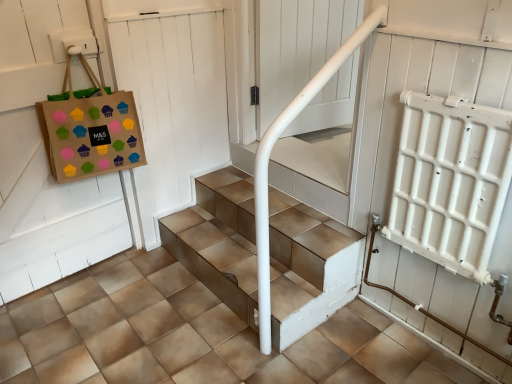
You are a GUI agent. You are given a task and a screenshot of the screen. Output one action in this format:
    pyautogui.click(x=<x>, y=<y>)
    Task: Click on the brown tile concrete at center
    
    Given the screenshot: What is the action you would take?
    pyautogui.click(x=193, y=336)

What do you see at coordinates (308, 268) in the screenshot? Image resolution: width=512 pixels, height=384 pixels. I see `metallic tile stairs at center` at bounding box center [308, 268].

What do you see at coordinates (174, 98) in the screenshot? I see `white wooden door at upper left` at bounding box center [174, 98].

The width and height of the screenshot is (512, 384). Find the location of `brown tile concrete at center`. brown tile concrete at center is located at coordinates (193, 336).

Do you think brown tile concrete at center is within white wooden door at upper left, or outside of it?

brown tile concrete at center is located beyond the bounds of white wooden door at upper left.

In terms of size, does brown tile concrete at center appear bigger or smaller than white wooden door at upper left?

Considering their sizes, brown tile concrete at center takes up more space than white wooden door at upper left.

Where is `concrete below the white wooden door at upper left (from the image's perspective)`? concrete below the white wooden door at upper left (from the image's perspective) is located at coordinates (193, 336).

Between metallic tile stairs at center and white wooden door at upper left, which one appears on the left side from the viewer's perspective?

Positioned to the left is white wooden door at upper left.

From a real-world perspective, which is physically above, metallic tile stairs at center or white wooden door at upper left?

white wooden door at upper left.

Considering their positions, is metallic tile stairs at center located in front of or behind white wooden door at upper left?

metallic tile stairs at center is in front of white wooden door at upper left.

Considering the relative sizes of metallic tile stairs at center and white wooden door at upper left in the image provided, is metallic tile stairs at center bigger than white wooden door at upper left?

Yes, metallic tile stairs at center is bigger than white wooden door at upper left.

Which point is more forward, (x=166, y=185) or (x=194, y=357)?

The point (x=194, y=357) is more forward.

How different are the orientations of white wooden door at upper left and brown tile concrete at center in degrees?

89.3 degrees.

Is white wooden door at upper left far away from brown tile concrete at center?

They are positioned close to each other.

Is there a large distance between white glossy handrail at upper center and brown tile concrete at center?

That's right, there is a large distance between white glossy handrail at upper center and brown tile concrete at center.

From the image's perspective, which one is positioned lower, white glossy handrail at upper center or brown tile concrete at center?

brown tile concrete at center is shown below in the image.

In terms of height, does white glossy handrail at upper center look taller or shorter compared to brown tile concrete at center?

white glossy handrail at upper center is taller than brown tile concrete at center.

How different are the orientations of white wooden door at upper left and metallic tile stairs at center in degrees?

white wooden door at upper left and metallic tile stairs at center are facing 91.1 degrees away from each other.

Is white wooden door at upper left positioned with its back to metallic tile stairs at center?

That's not correct — white wooden door at upper left is not looking away from metallic tile stairs at center.

Which of these two, white wooden door at upper left or metallic tile stairs at center, stands shorter?

metallic tile stairs at center.

Looking at this image, does white wooden door at upper left come in front of metallic tile stairs at center?

No, the depth of white wooden door at upper left is greater than that of metallic tile stairs at center.

Can you confirm if brown paper bag with colorful cupcake stickers at upper left is shorter than metallic tile stairs at center?

No.

From the image's perspective, would you say brown paper bag with colorful cupcake stickers at upper left is shown under metallic tile stairs at center?

Actually, brown paper bag with colorful cupcake stickers at upper left appears above metallic tile stairs at center in the image.

Is point (109, 102) positioned before point (236, 216)?

Yes, it is in front of point (236, 216).

From a real-world perspective, is brown paper bag with colorful cupcake stickers at upper left under metallic tile stairs at center?

No, from a real-world perspective, brown paper bag with colorful cupcake stickers at upper left is not beneath metallic tile stairs at center.

Based on the photo, is brown paper bag with colorful cupcake stickers at upper left positioned with its back to white wooden door at upper left?

brown paper bag with colorful cupcake stickers at upper left is not turned away from white wooden door at upper left.

Measure the distance from brown paper bag with colorful cupcake stickers at upper left to white wooden door at upper left.

A distance of 12.38 inches exists between brown paper bag with colorful cupcake stickers at upper left and white wooden door at upper left.

Is brown paper bag with colorful cupcake stickers at upper left bigger than white wooden door at upper left?

Yes, brown paper bag with colorful cupcake stickers at upper left is bigger than white wooden door at upper left.

What's the angular difference between brown paper bag with colorful cupcake stickers at upper left and white wooden door at upper left's facing directions?

The facing directions of brown paper bag with colorful cupcake stickers at upper left and white wooden door at upper left are 1.91 degrees apart.

Locate an element on the screen. This screenshot has width=512, height=384. door on the left of brown tile concrete at center is located at coordinates (174, 98).

Where is `door that appears behind the metallic tile stairs at center`? The image size is (512, 384). door that appears behind the metallic tile stairs at center is located at coordinates (174, 98).

Considering their positions, is brown tile concrete at center positioned further to brown paper bag with colorful cupcake stickers at upper left than white glossy handrail at upper center?

Based on the image, white glossy handrail at upper center appears to be further to brown paper bag with colorful cupcake stickers at upper left.

From the image, which object appears to be farther from white glossy handrail at upper center, metallic tile stairs at center or brown tile concrete at center?

brown tile concrete at center is positioned further to the anchor white glossy handrail at upper center.

From the picture: When comparing their distances from brown tile concrete at center, does brown paper bag with colorful cupcake stickers at upper left or metallic tile stairs at center seem further?

brown paper bag with colorful cupcake stickers at upper left lies further to brown tile concrete at center than the other object.

When comparing their distances from white glossy handrail at upper center, does metallic tile stairs at center or white wooden door at upper left seem further?

metallic tile stairs at center is positioned further to the anchor white glossy handrail at upper center.

Considering their positions, is white glossy handrail at upper center positioned further to brown paper bag with colorful cupcake stickers at upper left than white wooden door at upper left?

Based on the image, white glossy handrail at upper center appears to be further to brown paper bag with colorful cupcake stickers at upper left.

Which object lies further to the anchor point white wooden door at upper left, white glossy handrail at upper center or metallic tile stairs at center?

Based on the image, metallic tile stairs at center appears to be further to white wooden door at upper left.

Estimate the real-world distances between objects in this image. Which object is further from white glossy handrail at upper center, white wooden door at upper left or brown paper bag with colorful cupcake stickers at upper left?

The object further to white glossy handrail at upper center is brown paper bag with colorful cupcake stickers at upper left.

From the image, which object appears to be farther from white glossy handrail at upper center, brown paper bag with colorful cupcake stickers at upper left or brown tile concrete at center?

brown tile concrete at center lies further to white glossy handrail at upper center than the other object.

Locate an element on the screen. bag between white glossy handrail at upper center and brown tile concrete at center from top to bottom is located at coordinates coord(90,129).

You are a GUI agent. You are given a task and a screenshot of the screen. Output one action in this format:
    pyautogui.click(x=<x>, y=<y>)
    Task: Click on the stairs between brown paper bag with colorful cupcake stickers at upper left and white glossy handrail at upper center in the horizontal direction
    This screenshot has width=512, height=384.
    Given the screenshot: What is the action you would take?
    pyautogui.click(x=308, y=268)

Where is `stairs positioned between brown tile concrete at center and white wooden door at upper left from near to far`? This screenshot has width=512, height=384. stairs positioned between brown tile concrete at center and white wooden door at upper left from near to far is located at coordinates (308, 268).

Find the location of a particular element. The height and width of the screenshot is (384, 512). door between brown paper bag with colorful cupcake stickers at upper left and metallic tile stairs at center from left to right is located at coordinates (174, 98).